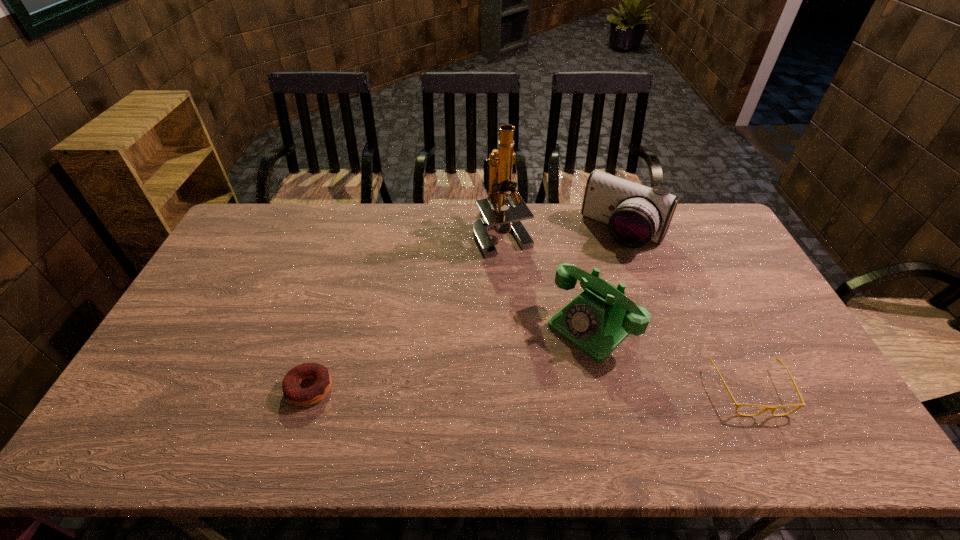
Where is `free space on the desktop that is between the leftmost object and the spectacles and is positioned at the eyepiece of the microscope`? free space on the desktop that is between the leftmost object and the spectacles and is positioned at the eyepiece of the microscope is located at coordinates (488, 389).

The image size is (960, 540). In order to click on free space on the desktop that is between the leftmost object and the spectacles and is positioned on the surface of the camcorder in this screenshot , I will do `click(511, 389)`.

Where is `free space on the desktop that is between the leftmost object and the spectacles and is positioned on the dial of the telephone`? The height and width of the screenshot is (540, 960). free space on the desktop that is between the leftmost object and the spectacles and is positioned on the dial of the telephone is located at coordinates (523, 389).